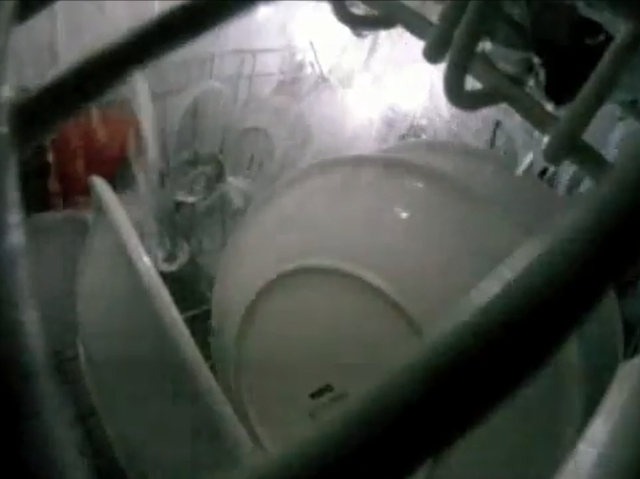
This screenshot has width=640, height=479. I want to click on dishes placed in the dishwasher, so click(269, 105).